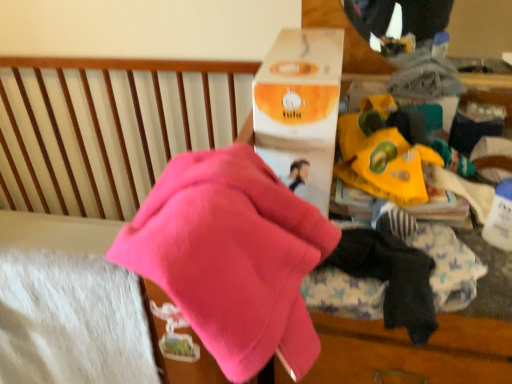
Image resolution: width=512 pixels, height=384 pixels. Identify the location of orange matte cardboard box at upper center. (300, 110).

This screenshot has height=384, width=512. What do you see at coordinates (388, 167) in the screenshot? I see `yellow paper bag at center` at bounding box center [388, 167].

Where is `dark blue cotton socks at lower right`? Image resolution: width=512 pixels, height=384 pixels. dark blue cotton socks at lower right is located at coordinates (391, 278).

Is orange matte cardboard box at upper center at the left side of pink fleece at center?

In fact, orange matte cardboard box at upper center is to the right of pink fleece at center.

Is orange matte cardboard box at upper center oriented away from pink fleece at center?

No, orange matte cardboard box at upper center is not facing the opposite direction of pink fleece at center.

Is point (267, 57) positioned before point (230, 249)?

No.

Is dark blue cotton socks at lower right situated inside pink fleece at center or outside?

dark blue cotton socks at lower right is not inside pink fleece at center, it's outside.

Is point (424, 256) closer or farther from the camera than point (227, 355)?

Point (424, 256) appears to be farther away from the viewer than point (227, 355).

Is dark blue cotton socks at lower right aimed at pink fleece at center?

No, dark blue cotton socks at lower right is not aimed at pink fleece at center.

From a real-world perspective, is dark blue cotton socks at lower right positioned over pink fleece at center based on gravity?

Actually, dark blue cotton socks at lower right is physically below pink fleece at center in the real world.

Identify the location of baby clothe in front of the yellow paper bag at center. (391, 278).

Considering the positions of points (406, 176) and (396, 278), is point (406, 176) farther from camera compared to point (396, 278)?

Yes, point (406, 176) is behind point (396, 278).

Which of these two, yellow paper bag at center or dark blue cotton socks at lower right, stands taller?

Standing taller between the two is dark blue cotton socks at lower right.

Consider the image. Between yellow paper bag at center and dark blue cotton socks at lower right, which one has larger width?

yellow paper bag at center.

Considering the sizes of yellow paper bag at center and pink fleece at center in the image, is yellow paper bag at center wider or thinner than pink fleece at center?

Clearly, yellow paper bag at center has less width compared to pink fleece at center.

Based on the photo, considering the positions of objects yellow paper bag at center and pink fleece at center in the image provided, who is more to the right, yellow paper bag at center or pink fleece at center?

yellow paper bag at center is more to the right.

Which point is more forward, (403, 171) or (197, 239)?

The point (197, 239) is in front.

Does point (430, 272) appear closer or farther from the camera than point (388, 191)?

Point (430, 272) is closer to the camera than point (388, 191).

Considering their positions, is dark blue cotton socks at lower right located in front of or behind yellow paper bag at center?

dark blue cotton socks at lower right is positioned closer to the viewer than yellow paper bag at center.

In the image, there is a dark blue cotton socks at lower right. At what (x,y) coordinates should I click in order to perform the action: click on toy above it (from the image's perspective). Please return your answer as a coordinate pair (x, y). The image size is (512, 384). Looking at the image, I should click on (388, 167).

Find the location of `underclothes above the dark blue cotton socks at lower right (from the image's perspective)`. underclothes above the dark blue cotton socks at lower right (from the image's perspective) is located at coordinates (232, 257).

Which is closer, (268, 175) or (343, 242)?

Clearly, point (268, 175) is closer to the camera than point (343, 242).

From a real-world perspective, is pink fleece at center physically above dark blue cotton socks at lower right?

Yes.

Does pink fleece at center touch dark blue cotton socks at lower right?

No, pink fleece at center is not in contact with dark blue cotton socks at lower right.

Which of these two, pink fleece at center or orange matte cardboard box at upper center, stands shorter?

pink fleece at center.

At what (x,y) coordinates should I click in order to perform the action: click on underclothes in front of the orange matte cardboard box at upper center. Please return your answer as a coordinate pair (x, y). Looking at the image, I should click on (232, 257).

Considering the positions of objects pink fleece at center and orange matte cardboard box at upper center in the image provided, who is behind, pink fleece at center or orange matte cardboard box at upper center?

orange matte cardboard box at upper center is further away from the camera.

Locate an element on the screen. Image resolution: width=512 pixels, height=384 pixels. underclothes that appears in front of the orange matte cardboard box at upper center is located at coordinates (232, 257).

Locate an element on the screen. The image size is (512, 384). baby clothe behind the pink fleece at center is located at coordinates (391, 278).

In the scene shown: Looking at the image, which one is located closer to orange matte cardboard box at upper center, dark blue cotton socks at lower right or yellow paper bag at center?

yellow paper bag at center lies closer to orange matte cardboard box at upper center than the other object.

Looking at the image, which one is located closer to pink fleece at center, yellow paper bag at center or dark blue cotton socks at lower right?

dark blue cotton socks at lower right.

Based on their spatial positions, is yellow paper bag at center or pink fleece at center further from orange matte cardboard box at upper center?

Based on the image, pink fleece at center appears to be further to orange matte cardboard box at upper center.

From the image, which object appears to be nearer to dark blue cotton socks at lower right, pink fleece at center or yellow paper bag at center?

yellow paper bag at center.

Looking at the image, which one is located further to dark blue cotton socks at lower right, yellow paper bag at center or pink fleece at center?

Among the two, pink fleece at center is located further to dark blue cotton socks at lower right.

Which object lies further to the anchor point pink fleece at center, yellow paper bag at center or orange matte cardboard box at upper center?

The object further to pink fleece at center is yellow paper bag at center.

From the image, which object appears to be farther from dark blue cotton socks at lower right, pink fleece at center or orange matte cardboard box at upper center?

orange matte cardboard box at upper center.

Considering their positions, is orange matte cardboard box at upper center positioned closer to yellow paper bag at center than pink fleece at center?

orange matte cardboard box at upper center lies closer to yellow paper bag at center than the other object.

At what (x,y) coordinates should I click in order to perform the action: click on baby clothe between pink fleece at center and orange matte cardboard box at upper center along the z-axis. Please return your answer as a coordinate pair (x, y). This screenshot has height=384, width=512. Looking at the image, I should click on (391, 278).

Identify the location of cardboard box between pink fleece at center and yellow paper bag at center along the z-axis. (300, 110).

You are a GUI agent. You are given a task and a screenshot of the screen. Output one action in this format:
    pyautogui.click(x=<x>, y=<y>)
    Task: Click on the toy that lies between orange matte cardboard box at upper center and dark blue cotton socks at lower right from top to bottom
    This screenshot has height=384, width=512.
    Given the screenshot: What is the action you would take?
    [388, 167]

Locate an element on the screen. Image resolution: width=512 pixels, height=384 pixels. baby clothe located between pink fleece at center and yellow paper bag at center in the depth direction is located at coordinates (391, 278).